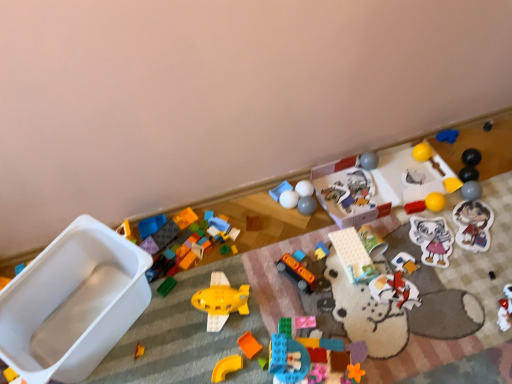
The height and width of the screenshot is (384, 512). I want to click on vacant space that's between white glossy sticker at center-right, arranged as the twentieth toy when viewed from the left, and pink matte block at center, the twelfth toy viewed from the left, so click(x=376, y=283).